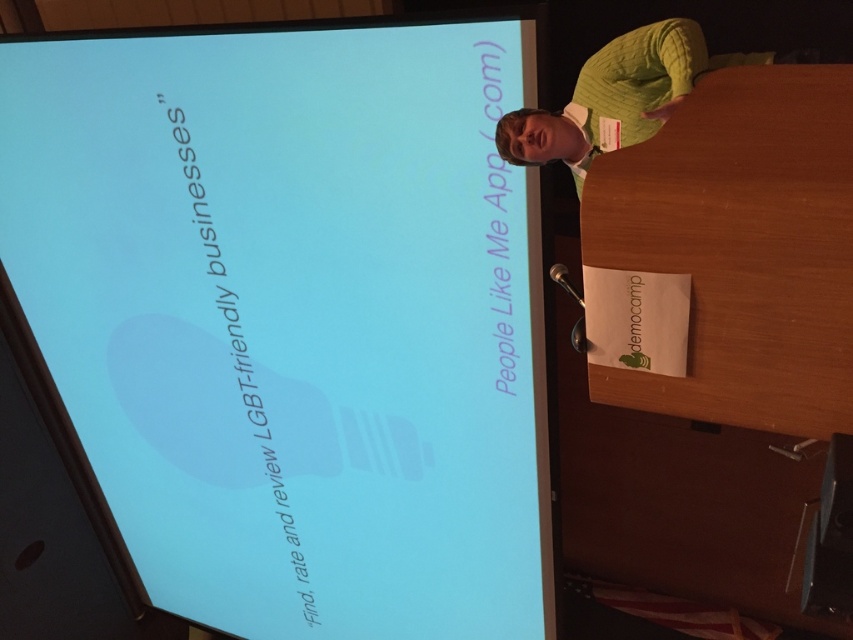
Is matte blue screen at upper left below green knitted sweater at upper right?

Yes.

Does matte blue screen at upper left appear over green knitted sweater at upper right?

No.

What do you see at coordinates (293, 317) in the screenshot? I see `matte blue screen at upper left` at bounding box center [293, 317].

Find the location of a particular element. The height and width of the screenshot is (640, 853). matte blue screen at upper left is located at coordinates (293, 317).